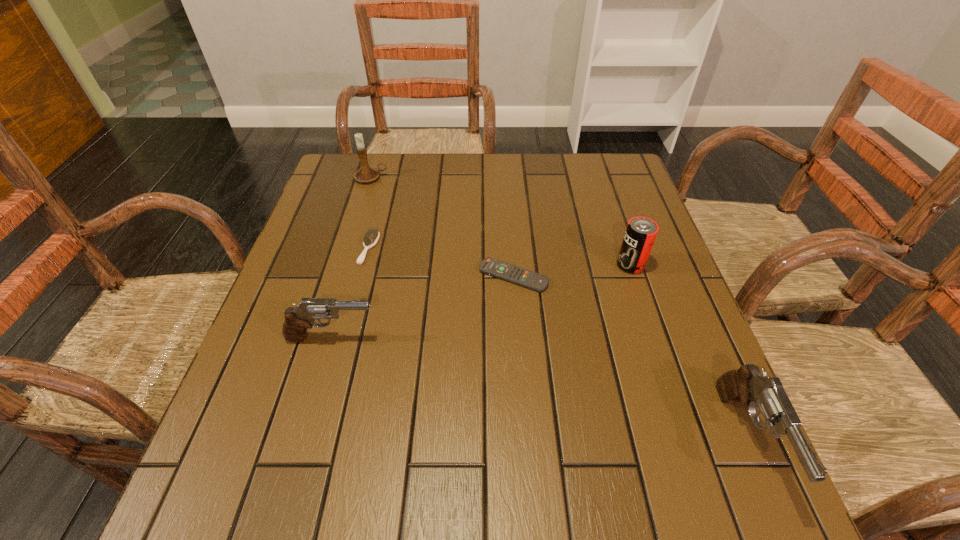
If equal spacing is desired by inserting an extra pistol among them, please point out a free spot for this new pistol. Please provide its 2D coordinates. Your answer should be formatted as a tuple, i.e. [(x, y)], where the tuple contains the x and y coordinates of a point satisfying the conditions above.

[(520, 383)]